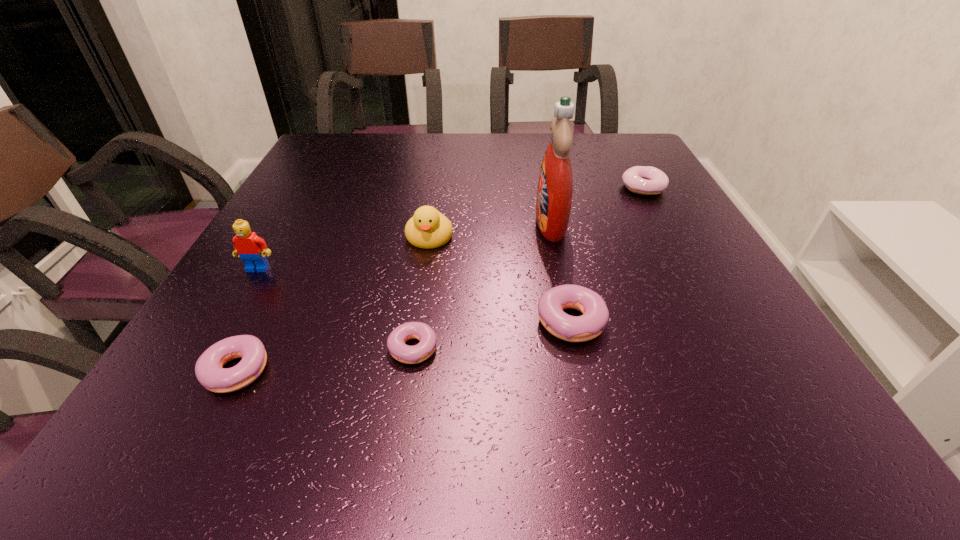
The image size is (960, 540). Find the location of `doughnut at the left edge`. doughnut at the left edge is located at coordinates (208, 369).

This screenshot has width=960, height=540. I want to click on Lego present at the left edge, so click(252, 249).

You are a GUI agent. You are given a task and a screenshot of the screen. Output one action in this format:
    pyautogui.click(x=<x>, y=<y>)
    Task: Click on the object situated at the right edge
    The image size is (960, 540).
    Given the screenshot: What is the action you would take?
    pyautogui.click(x=645, y=180)

Identify the location of object that is positioned at the near left corner. This screenshot has width=960, height=540. (208, 369).

In the image, there is a desktop. Where is `vacant space at the far edge`? vacant space at the far edge is located at coordinates (461, 151).

Identify the location of free space at the near edge of the desktop. (582, 372).

Locate an element on the screen. This screenshot has height=540, width=960. vacant region at the left edge of the desktop is located at coordinates (268, 241).

Locate an element on the screen. vacant space at the right edge of the desktop is located at coordinates (637, 249).

This screenshot has height=540, width=960. In order to click on vacant region at the far left corner of the desktop in this screenshot , I will do `click(340, 158)`.

The height and width of the screenshot is (540, 960). Identify the location of free location at the far right corner. (610, 162).